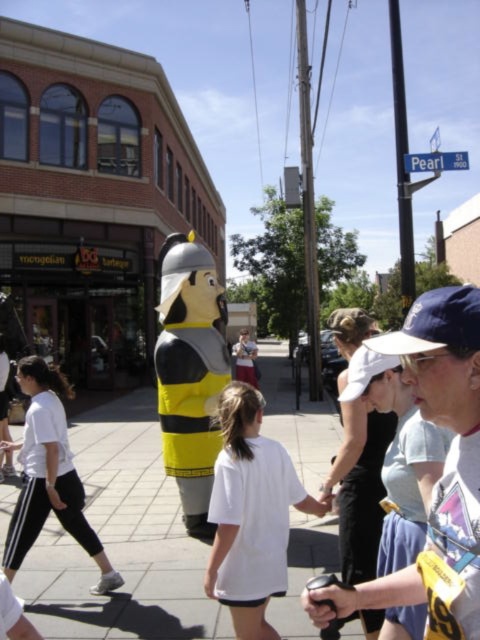
Question: Estimate the real-world distances between objects in this image. Which object is closer to the yellow and black plush at center?

Choices:
 (A) white cotton shirt at center
 (B) white matte t-shirt at center
 (C) gray concrete sidewalk at center

Answer: (B)

Question: Is white cotton shirt at center to the left of yellow and black plush at center from the viewer's perspective?

Choices:
 (A) no
 (B) yes

Answer: (A)

Question: Which of these objects is positioned closest to the yellow and black plush at center?

Choices:
 (A) white cotton shirt at center
 (B) gray concrete sidewalk at center
 (C) white matte t-shirt at center

Answer: (C)

Question: Does gray concrete sidewalk at center come behind yellow and black plush at center?

Choices:
 (A) no
 (B) yes

Answer: (A)

Question: Which point is farther from the camera taking this photo?

Choices:
 (A) pos(96,621)
 (B) pos(64,516)
 (C) pos(219,420)

Answer: (B)

Question: Does yellow and black plush at center have a lesser width compared to white matte t-shirt at center?

Choices:
 (A) no
 (B) yes

Answer: (B)